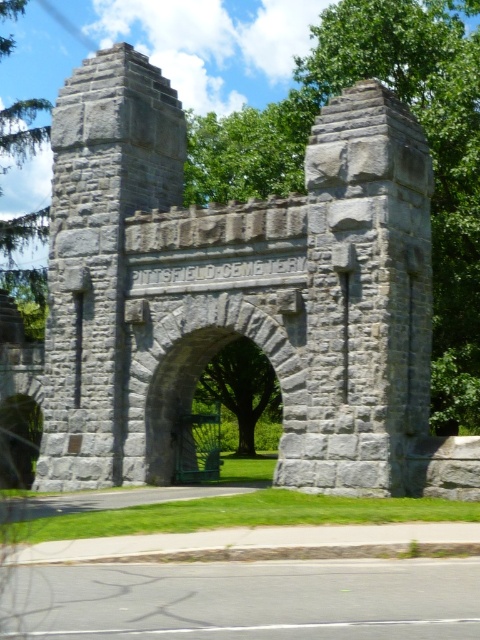
From the picture: You are a delivery person trying to enter Citysfield Cemetery through its main entrance. You have a large truck that is 3 meters wide. The gray stone gate at center and the gray stone archway at center are both part of the entrance structure. Can your truck pass through the entrance without any modifications?

The gray stone gate at center is wider than the gray stone archway at center. Since the truck is 3 meters wide, it can pass through the gray stone gate at center, but the archway might be narrower. However, the question mentions the entrance structure includes both the gate and archway. Therefore, the narrower archway determines passage. If the archway is narrower than 3 meters, the truck cannot pass. But since the gate is wider, perhaps the archway is part of the gate? The description says the gate is part

You are standing in front of the Citysfield Cemetery entrance. You notice two gray stone structures at the center. One is labeled as the gray stone gate at center and the other as the gray stone archway at center. Which one is positioned higher up?

The gray stone gate at center is located above the gray stone archway at center, so the gray stone gate at center is positioned higher up.

You are standing in front of the Citysfield Cemetery entrance and need to pass through the gray stone gate at center. However, you notice another structure, the gray stone archway at center. Which one is bigger and should you go through?

The gray stone gate at center is larger in size compared to the gray stone archway at center, so you should go through the gray stone gate at center.